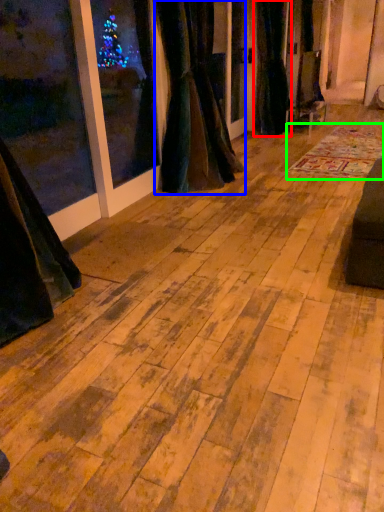
Question: Which object is the closest to the curtain (highlighted by a red box)? Choose among these: curtain (highlighted by a blue box) or mat (highlighted by a green box).

Choices:
 (A) curtain
 (B) mat

Answer: (B)